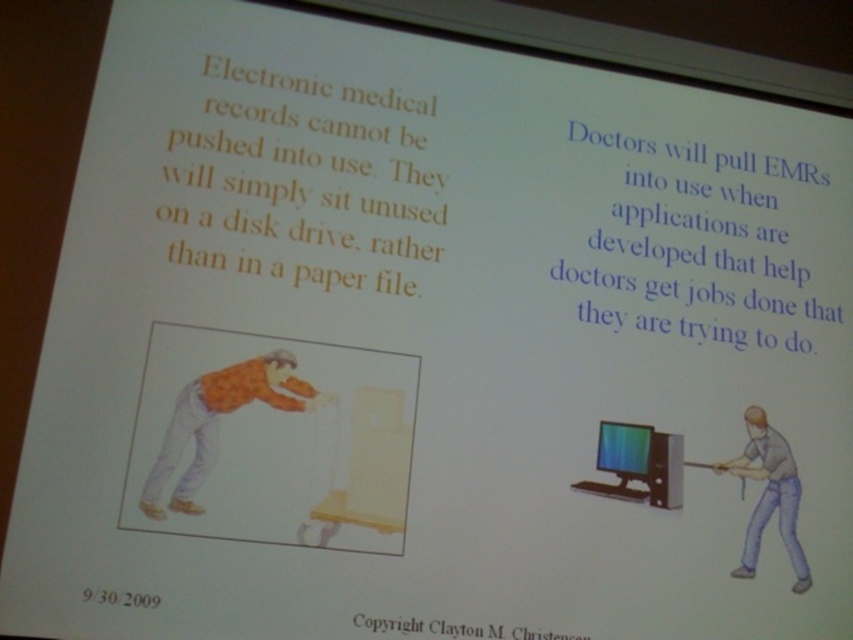
What is the position of the orange printed shirt at lower left?

The orange printed shirt at lower left is located at point (218,422).

You are observing a presentation slide about electronic medical records. The slide has two sections. In the left section, there is an illustration of a person pushing a cart, and the text explains that EMRs cannot be forced into use. On the right side, there is an illustration of a doctor in an orange printed shirt at lower left and a matte black monitor at center. The text mentions doctors pulling EMRs into use when applications are available. Based on the spatial arrangement of the orange printed shirt at

The orange printed shirt at lower left is above the matte black monitor at center, indicating that the doctor is positioned higher than the monitor, possibly suggesting a more active or prominent role in the scenario compared to the monitor.